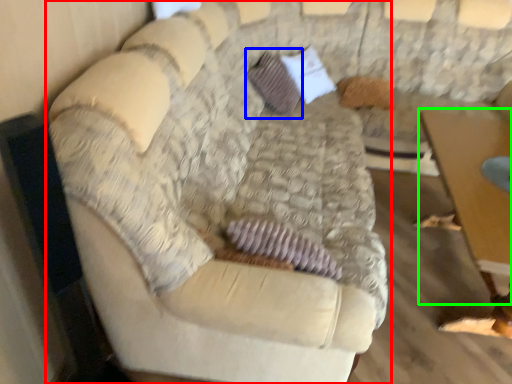
Question: Which object is the closest to the studio couch (highlighted by a red box)? Choose among these: pillow (highlighted by a blue box) or table (highlighted by a green box).

Choices:
 (A) pillow
 (B) table

Answer: (B)